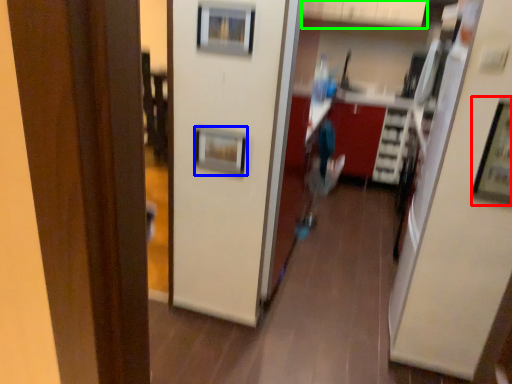
Question: Which object is positioned farthest from picture frame (highlighted by a red box)? Select from picture frame (highlighted by a blue box) and cabinetry (highlighted by a green box).

Choices:
 (A) picture frame
 (B) cabinetry

Answer: (B)